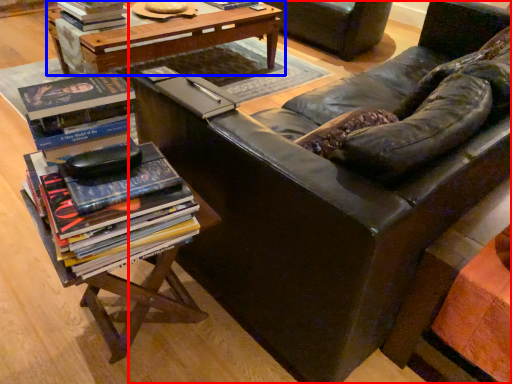
Question: Which point is further to the camera, studio couch (highlighted by a red box) or table (highlighted by a blue box)?

Choices:
 (A) studio couch
 (B) table

Answer: (B)